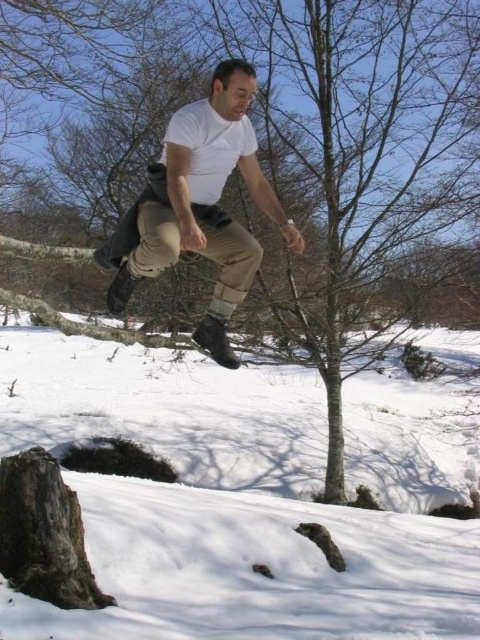
Is white powdery snow at lower center wider than white matte t-shirt at center?

Indeed, white powdery snow at lower center has a greater width compared to white matte t-shirt at center.

How much distance is there between white powdery snow at lower center and white matte t-shirt at center?

The distance of white powdery snow at lower center from white matte t-shirt at center is 5.40 meters.

Does point (166, 442) lie behind point (227, 307)?

Yes.

This screenshot has width=480, height=640. What are the coordinates of `white powdery snow at lower center` in the screenshot? It's located at (249, 497).

Can you confirm if white powdery snow at lower center is positioned above khaki pants at center?

No.

Between white powdery snow at lower center and khaki pants at center, which one has less height?

khaki pants at center

Who is more distant from viewer, (395, 429) or (159, 260)?

The point (395, 429) is more distant.

What are the coordinates of `white powdery snow at lower center` in the screenshot? It's located at (249, 497).

Measure the distance between point (x=213, y=211) and camera.

Point (x=213, y=211) and camera are 4.20 meters apart from each other.

Does white matte t-shirt at center appear on the left side of khaki pants at center?

In fact, white matte t-shirt at center is to the right of khaki pants at center.

This screenshot has height=640, width=480. In order to click on white matte t-shirt at center in this screenshot , I will do `click(200, 205)`.

Locate an element on the screen. This screenshot has width=480, height=640. white matte t-shirt at center is located at coordinates (200, 205).